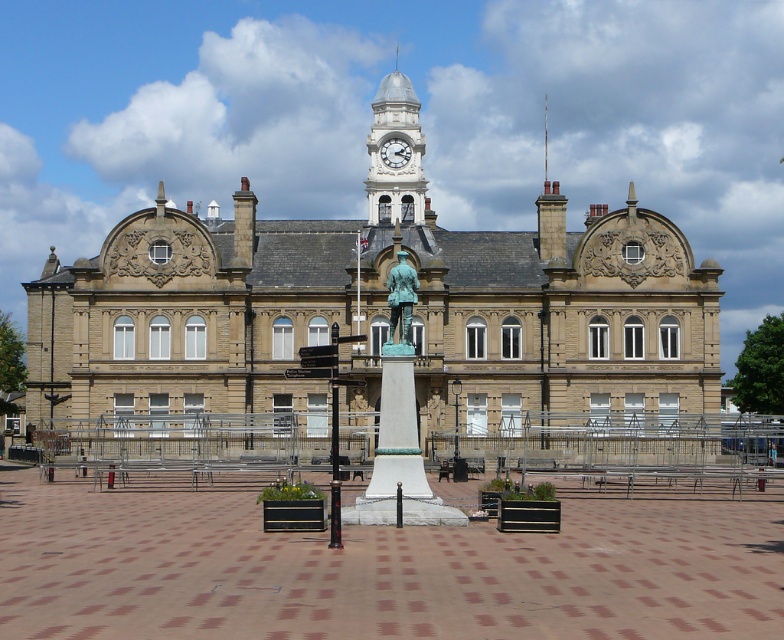
You are a tour guide explaining the building to visitors. You mention both the bronze statue at center and the white stone clock at upper center. Which one is taller?

The bronze statue at center is taller than the white stone clock at upper center.

You are a tourist standing in front of the grand historic building. You see the bronze statue at center and the white stone clock at upper center. Which object is located to the right of the other?

The bronze statue at center is positioned on the right side of white stone clock at upper center.

You are standing in front of the historic building and want to walk towards the white stone clock at upper center. Which direction should you move relative to the brick paving at center?

To reach the white stone clock at upper center, you should move to the right from the brick paving at center since the brick paving at center is located to its left.